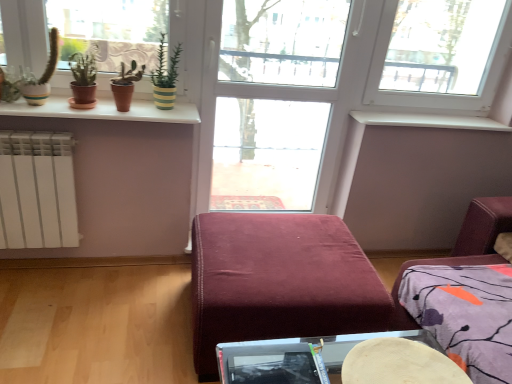
Question: In terms of width, does white glossy window sill at upper left, positioned as the 1th window sill in left-to-right order, look wider or thinner when compared to transparent glass door at center?

Choices:
 (A) thin
 (B) wide

Answer: (B)

Question: Is point (169, 109) closer or farther from the camera than point (242, 148)?

Choices:
 (A) farther
 (B) closer

Answer: (B)

Question: Which of these objects is positioned farthest from the white smooth window sill at upper center, placed as the 2th window sill when sorted from front to back?

Choices:
 (A) white glossy window sill at upper left, acting as the second window sill starting from the right
 (B) white plastic window at upper right
 (C) velvet burgundy ottoman at center
 (D) transparent glass door at center
 (E) wooden round table at lower center

Answer: (E)

Question: Which is farther from the green striped pot at upper center?

Choices:
 (A) wooden round table at lower center
 (B) transparent glass door at center
 (C) white glossy window sill at upper left, which ranks as the first window sill in front-to-back order
 (D) white plastic window at upper right
 (E) velvet burgundy ottoman at center

Answer: (D)